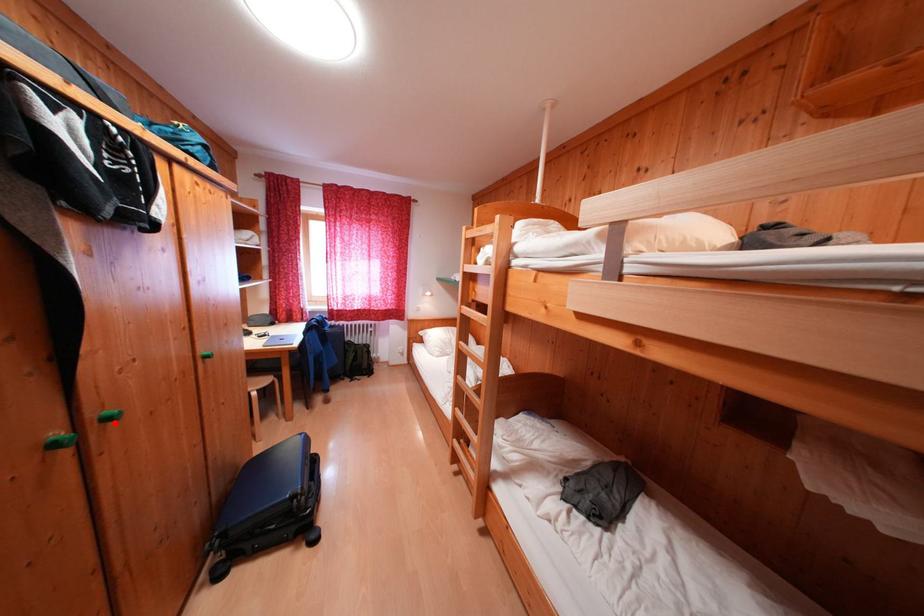
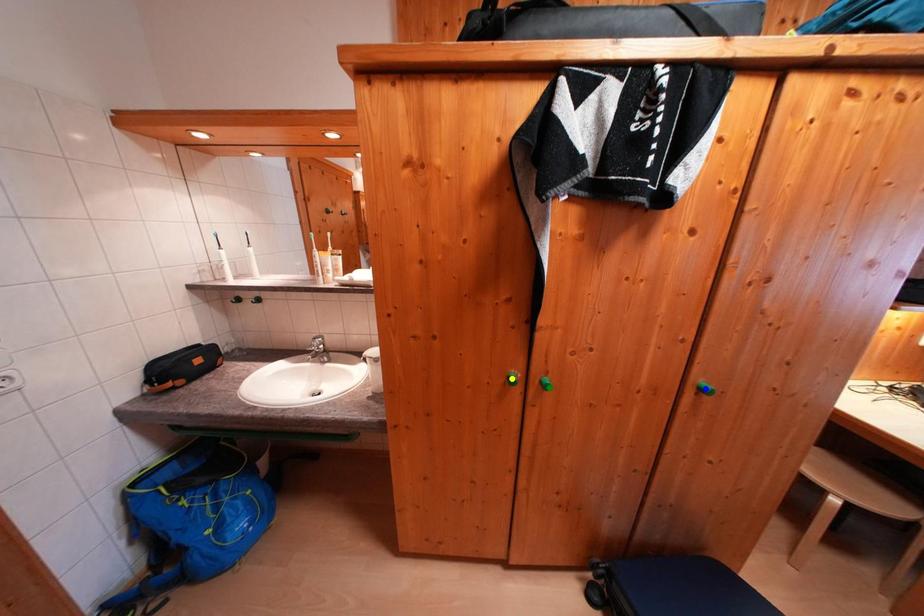
Question: I am providing you with two images of the same scene from different viewpoints. A red point is marked on the first image. You are given multiple points on the second image. Which mark in image 2 goes with the point in image 1?

Choices:
 (A) green point
 (B) blue point
 (C) yellow point

Answer: (A)